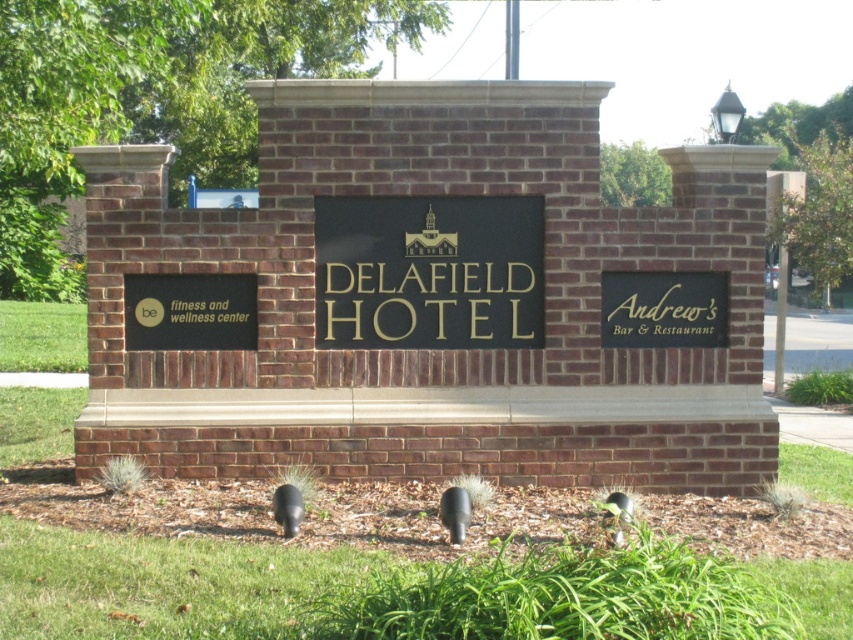
Question: Among these objects, which one is farthest from the camera?

Choices:
 (A) black matte sign at lower left
 (B) black matte sign at right

Answer: (B)

Question: Can you confirm if black matte sign at lower left is bigger than black matte sign at right?

Choices:
 (A) yes
 (B) no

Answer: (B)

Question: Where is goldmaterial/texture sign at center located in relation to black matte sign at lower left in the image?

Choices:
 (A) above
 (B) below

Answer: (A)

Question: Is black matte sign at lower left to the left of black matte sign at right from the viewer's perspective?

Choices:
 (A) no
 (B) yes

Answer: (B)

Question: Which point is closer to the camera?

Choices:
 (A) black matte sign at right
 (B) goldmaterial/texture sign at center
 (C) black matte sign at lower left

Answer: (B)

Question: Which point appears closest to the camera in this image?

Choices:
 (A) (352, 224)
 (B) (241, 275)
 (C) (614, 328)

Answer: (B)